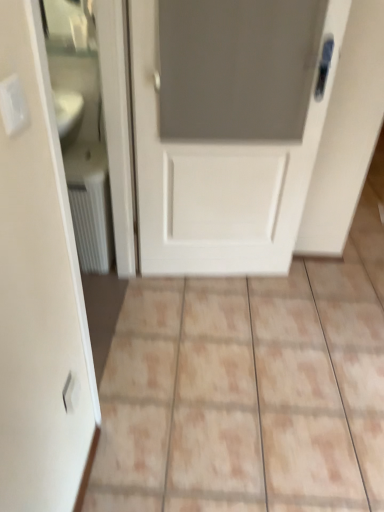
Question: From a real-world perspective, is white textured radiator at left located beneath beige ceramic tile at center?

Choices:
 (A) no
 (B) yes

Answer: (A)

Question: Is white textured radiator at left facing away from beige ceramic tile at center?

Choices:
 (A) no
 (B) yes

Answer: (A)

Question: Is the position of white textured radiator at left more distant than that of beige ceramic tile at center?

Choices:
 (A) no
 (B) yes

Answer: (B)

Question: From a real-world perspective, does white textured radiator at left stand above beige ceramic tile at center?

Choices:
 (A) yes
 (B) no

Answer: (A)

Question: From the image's perspective, is white textured radiator at left located above beige ceramic tile at center?

Choices:
 (A) no
 (B) yes

Answer: (B)

Question: Is white textured radiator at left located outside beige ceramic tile at center?

Choices:
 (A) yes
 (B) no

Answer: (A)

Question: Considering the relative sizes of white plastic electric outlet at lower left, which ranks as the second electric outlet in top-to-bottom order, and beige ceramic tile at center in the image provided, is white plastic electric outlet at lower left, which ranks as the second electric outlet in top-to-bottom order, shorter than beige ceramic tile at center?

Choices:
 (A) no
 (B) yes

Answer: (A)

Question: From a real-world perspective, does white plastic electric outlet at lower left, which ranks as the second electric outlet in top-to-bottom order, stand above beige ceramic tile at center?

Choices:
 (A) no
 (B) yes

Answer: (B)

Question: From the image's perspective, would you say white plastic electric outlet at lower left, the first electric outlet ordered from the bottom, is shown under beige ceramic tile at center?

Choices:
 (A) no
 (B) yes

Answer: (B)

Question: Is white plastic electric outlet at lower left, acting as the 2th electric outlet starting from the front, not close to beige ceramic tile at center?

Choices:
 (A) no
 (B) yes

Answer: (A)

Question: Can you confirm if white plastic electric outlet at lower left, which ranks as the second electric outlet in top-to-bottom order, is wider than beige ceramic tile at center?

Choices:
 (A) no
 (B) yes

Answer: (A)

Question: Does white plastic electric outlet at lower left, which ranks as the second electric outlet in top-to-bottom order, have a lesser width compared to beige ceramic tile at center?

Choices:
 (A) no
 (B) yes

Answer: (B)

Question: Can you confirm if white plastic electric outlet at upper left, acting as the 1th electric outlet starting from the top, is wider than white matte door at center?

Choices:
 (A) yes
 (B) no

Answer: (B)